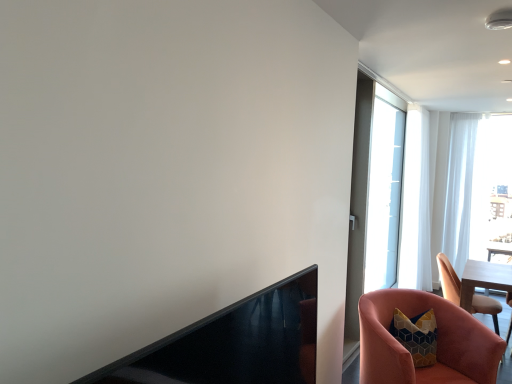
Question: Is pink velvet chair at lower right, the 2th chair in the front-to-back sequence, shorter than black glossy fireplace at lower left?

Choices:
 (A) no
 (B) yes

Answer: (A)

Question: Does pink velvet chair at lower right, the 2th chair in the front-to-back sequence, touch black glossy fireplace at lower left?

Choices:
 (A) yes
 (B) no

Answer: (B)

Question: Does pink velvet chair at lower right, the 2th chair in the front-to-back sequence, have a smaller size compared to black glossy fireplace at lower left?

Choices:
 (A) yes
 (B) no

Answer: (B)

Question: Is pink velvet chair at lower right, which is the 2th chair in left-to-right order, facing towards black glossy fireplace at lower left?

Choices:
 (A) yes
 (B) no

Answer: (B)

Question: Is the position of pink velvet chair at lower right, the 2th chair in the front-to-back sequence, more distant than that of black glossy fireplace at lower left?

Choices:
 (A) yes
 (B) no

Answer: (A)

Question: Considering the relative sizes of pink velvet chair at lower right, which ranks as the 1th chair in right-to-left order, and black glossy fireplace at lower left in the image provided, is pink velvet chair at lower right, which ranks as the 1th chair in right-to-left order, thinner than black glossy fireplace at lower left?

Choices:
 (A) yes
 (B) no

Answer: (B)

Question: Does pink velvet chair at lower right, the 2th chair in the front-to-back sequence, have a lesser height compared to pink velvet chair at lower right, the 2th chair from the right?

Choices:
 (A) no
 (B) yes

Answer: (A)

Question: Can you confirm if pink velvet chair at lower right, which ranks as the 1th chair in right-to-left order, is wider than pink velvet chair at lower right, the 2th chair from the right?

Choices:
 (A) yes
 (B) no

Answer: (B)

Question: From a real-world perspective, is pink velvet chair at lower right, which ranks as the 1th chair in right-to-left order, on pink velvet chair at lower right, which ranks as the 2th chair in back-to-front order?

Choices:
 (A) yes
 (B) no

Answer: (B)

Question: Does pink velvet chair at lower right, the 1th chair from the back, have a smaller size compared to pink velvet chair at lower right, which ranks as the 2th chair in back-to-front order?

Choices:
 (A) no
 (B) yes

Answer: (B)

Question: From a real-world perspective, is pink velvet chair at lower right, which ranks as the 1th chair in right-to-left order, located beneath pink velvet chair at lower right, the 1th chair viewed from the front?

Choices:
 (A) no
 (B) yes

Answer: (B)

Question: Could pink velvet chair at lower right, which ranks as the 2th chair in back-to-front order, be considered to be inside pink velvet chair at lower right, which ranks as the 1th chair in right-to-left order?

Choices:
 (A) no
 (B) yes

Answer: (A)

Question: Is pink velvet chair at lower right, which ranks as the 1th chair in right-to-left order, looking in the opposite direction of transparent glass screen door at upper right?

Choices:
 (A) no
 (B) yes

Answer: (B)